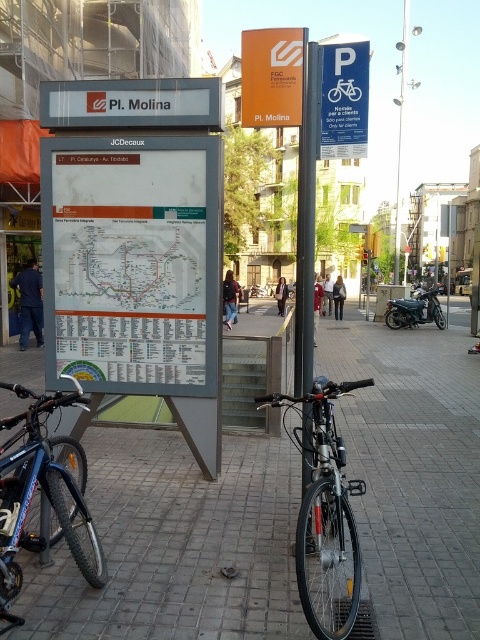
Question: Is white plastic sign at center wider than orange plastic sign at center?

Choices:
 (A) yes
 (B) no

Answer: (B)

Question: Considering the relative positions of black metal pole at center and blue plastic parking sign at upper right in the image provided, where is black metal pole at center located with respect to blue plastic parking sign at upper right?

Choices:
 (A) above
 (B) below

Answer: (A)

Question: Which object is farther from the camera taking this photo?

Choices:
 (A) black metal pole at center
 (B) blue metallic bicycle at lower left
 (C) orange plastic sign at center
 (D) blue plastic parking sign at upper right

Answer: (C)

Question: Based on their relative distances, which object is nearer to the metallic blue bicycle at center?

Choices:
 (A) white plastic sign at center
 (B) orange matte sign at upper center
 (C) black metal pole at center

Answer: (A)

Question: Which of the following is the farthest from the observer?

Choices:
 (A) metallic blue bicycle at center
 (B) blue metallic bicycle at lower left

Answer: (A)

Question: Is gray concrete pavement at center further to camera compared to orange matte sign at upper center?

Choices:
 (A) yes
 (B) no

Answer: (B)